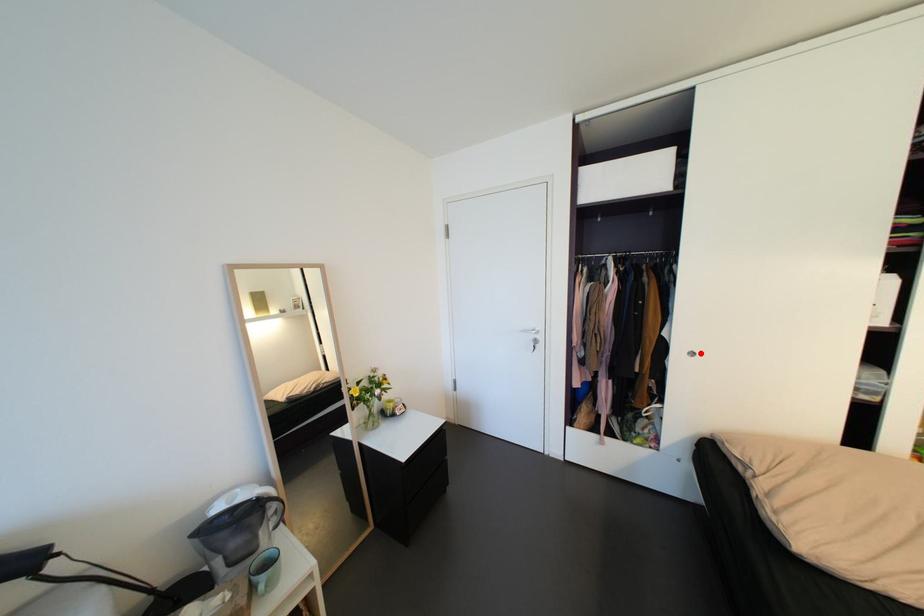
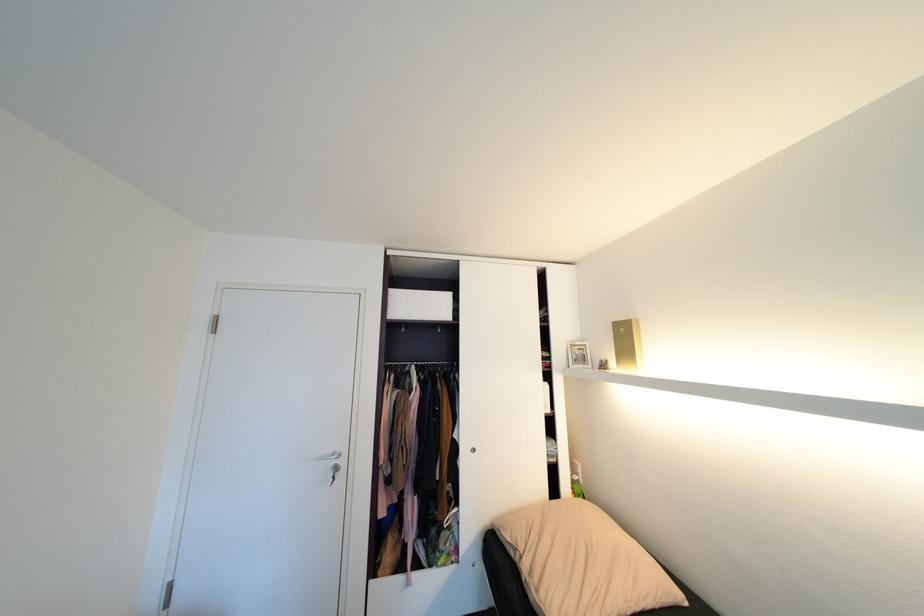
The point at the highlighted location is marked in the first image. Where is the corresponding point in the second image?

(481, 450)